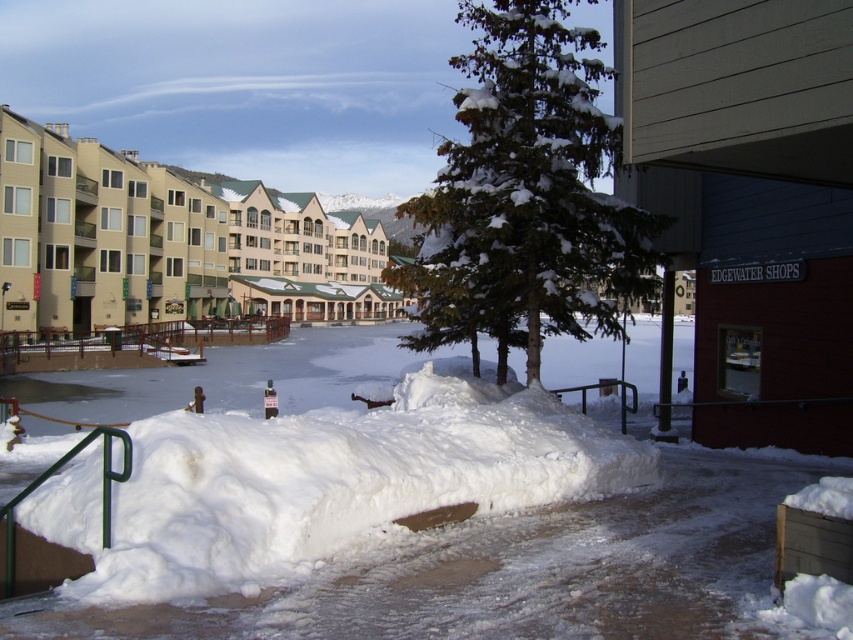
Question: Is white fluffy snow at center smaller than beige/matte building at upper left?

Choices:
 (A) yes
 (B) no

Answer: (A)

Question: Which point is closer to the camera?

Choices:
 (A) white fluffy snow at center
 (B) beige/matte building at upper left

Answer: (A)

Question: Is white fluffy snow at center above beige/matte building at upper left?

Choices:
 (A) no
 (B) yes

Answer: (A)

Question: Does white fluffy snow at center have a lesser width compared to beige/matte building at upper left?

Choices:
 (A) no
 (B) yes

Answer: (B)

Question: Which point is farther to the camera?

Choices:
 (A) (172, 563)
 (B) (148, 316)

Answer: (B)